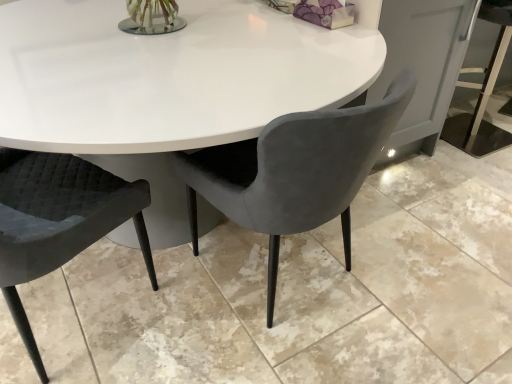
I want to click on vacant space to the right of velvet grey chair at center, acting as the second chair starting from the left, so click(419, 271).